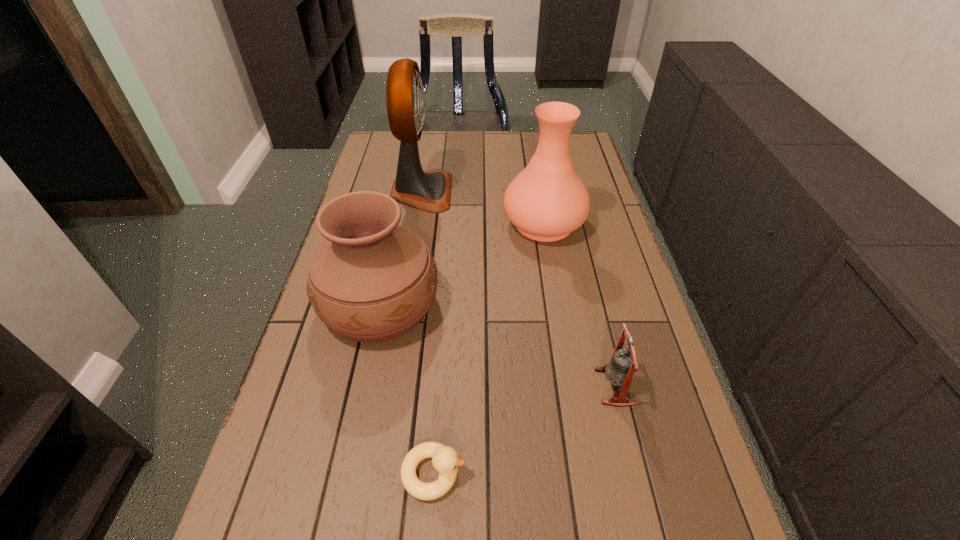
Locate an element on the screen. The width and height of the screenshot is (960, 540). vacant space located on the back of the urn is located at coordinates (392, 246).

The image size is (960, 540). Find the location of `vacant area situated 0.050m on the back of the second nearest object`. vacant area situated 0.050m on the back of the second nearest object is located at coordinates (605, 347).

Locate an element on the screen. The height and width of the screenshot is (540, 960). vacant area situated 0.320m at the beak of the shortest object is located at coordinates (642, 473).

The image size is (960, 540). I want to click on fan positioned at the left edge, so click(x=430, y=191).

At what (x,y) coordinates should I click in order to perform the action: click on urn that is at the left edge. Please return your answer as a coordinate pair (x, y). The width and height of the screenshot is (960, 540). Looking at the image, I should click on (372, 280).

The image size is (960, 540). In order to click on vase at the right edge in this screenshot , I will do `click(547, 201)`.

Locate an element on the screen. The height and width of the screenshot is (540, 960). bell that is at the right edge is located at coordinates (621, 370).

I want to click on free region at the far edge of the desktop, so pyautogui.click(x=464, y=140).

The width and height of the screenshot is (960, 540). I want to click on vacant region at the left edge of the desktop, so pyautogui.click(x=320, y=521).

Image resolution: width=960 pixels, height=540 pixels. In the image, there is a desktop. Identify the location of blank space at the right edge. (594, 187).